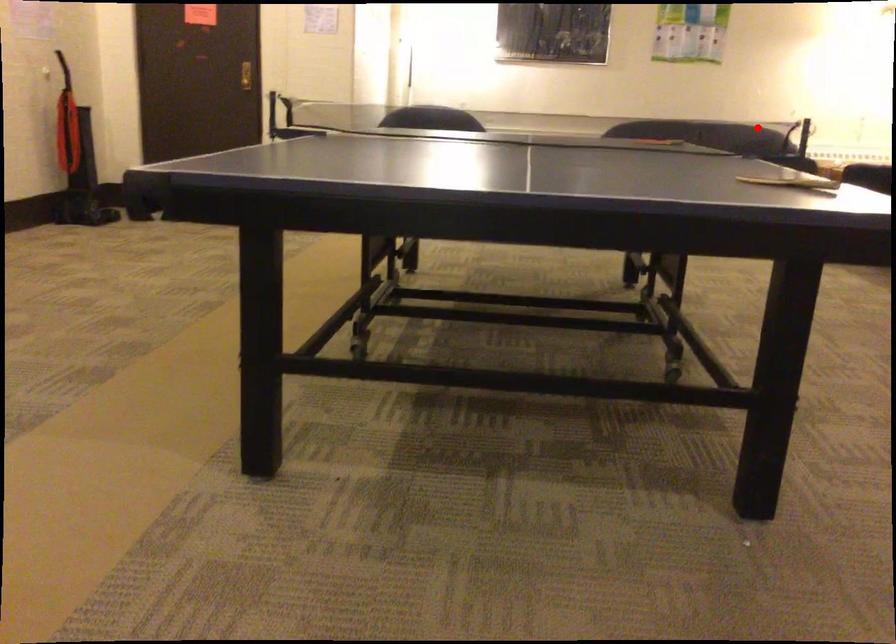
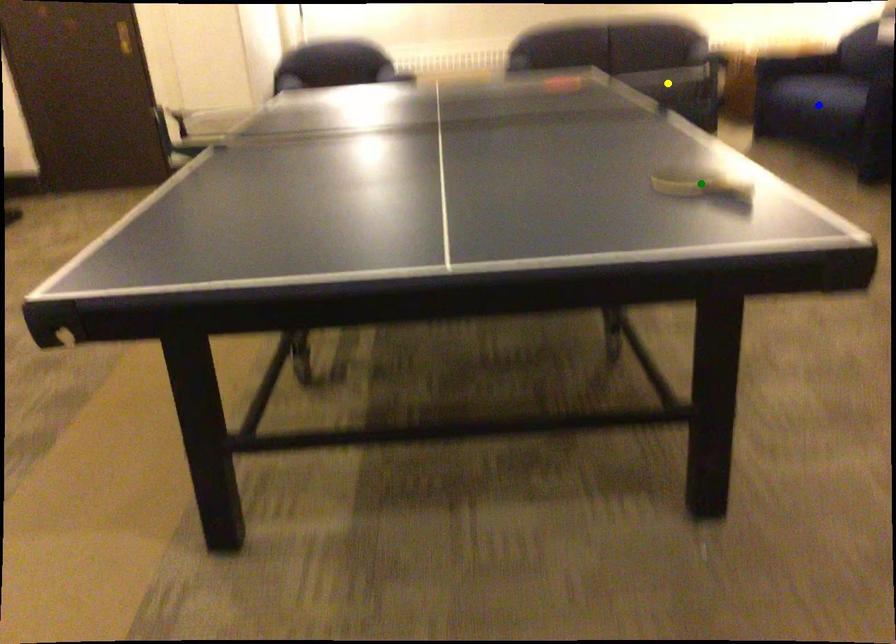
Question: I am providing you with two images of the same scene from different viewpoints. A red point is marked on the first image. You are given multiple points on the second image. Which point in image 2 is actually the same real-world point as the red point in image 1?

Choices:
 (A) yellow point
 (B) green point
 (C) blue point

Answer: (A)